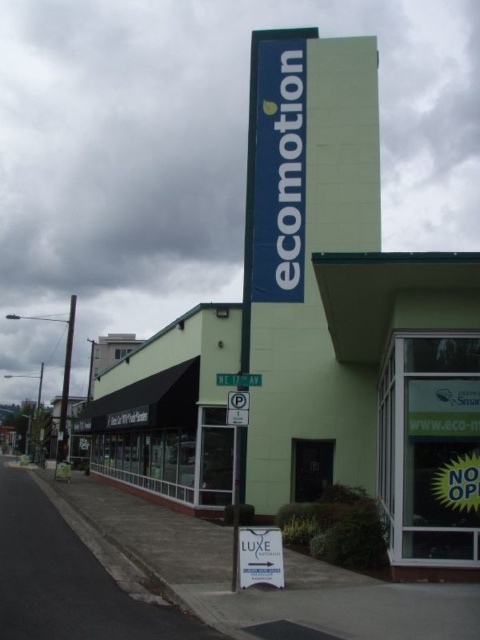
Which is in front, point (276, 541) or point (228, 413)?

Point (276, 541)

This screenshot has height=640, width=480. I want to click on white paper sign at center, so (x=260, y=556).

Does point (43, 164) come in front of point (240, 420)?

No, (43, 164) is further to viewer.

Which is in front, point (101, 209) or point (242, 417)?

Positioned in front is point (242, 417).

This screenshot has width=480, height=640. I want to click on green matte sign at upper center, so click(x=193, y=154).

Looking at this image, does green matte sign at upper center lie behind white paper sign at center?

Yes.

Who is positioned more to the right, green matte sign at upper center or white paper sign at center?

From the viewer's perspective, white paper sign at center appears more on the right side.

Is point (80, 294) less distant than point (269, 554)?

No, (80, 294) is behind (269, 554).

Where is `green matte sign at upper center`? The width and height of the screenshot is (480, 640). green matte sign at upper center is located at coordinates (193, 154).